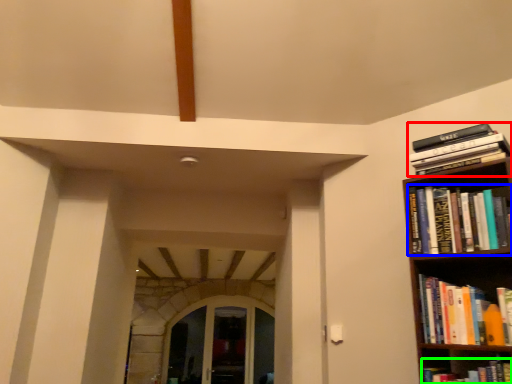
Question: Which is farther away from book (highlighted by a red box)? book (highlighted by a blue box) or book (highlighted by a green box)?

Choices:
 (A) book
 (B) book

Answer: (B)